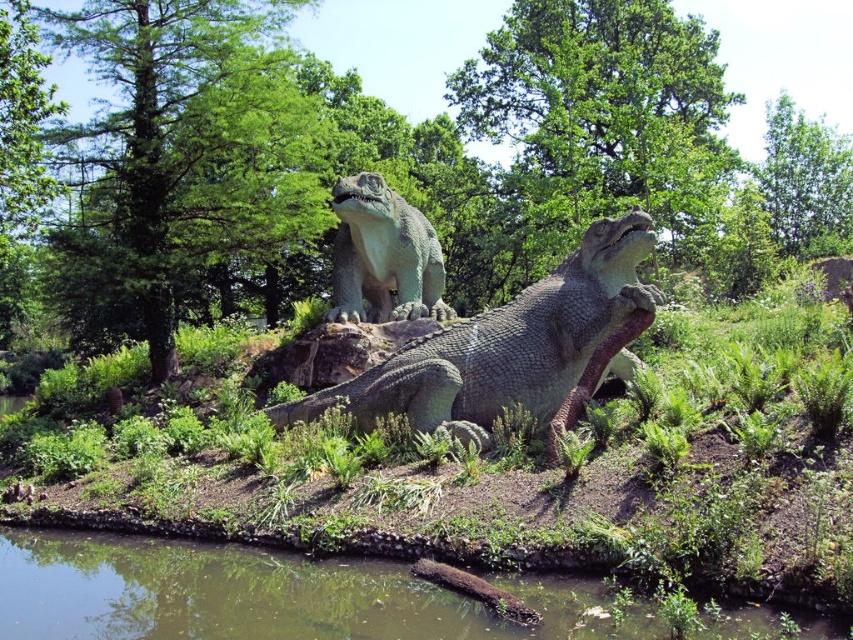
Is point (374, 570) closer to viewer compared to point (363, 317)?

That is True.

Which is behind, point (20, 584) or point (370, 198)?

Point (370, 198)

Identify the location of greenish water at lower center. Image resolution: width=853 pixels, height=640 pixels. (268, 595).

Who is more forward, (410, 424) or (399, 205)?

Positioned in front is point (410, 424).

The image size is (853, 640). In order to click on smooth gray crocodile at center in this screenshot , I will do `click(512, 348)`.

The height and width of the screenshot is (640, 853). What are the coordinates of `smooth gray crocodile at center` in the screenshot? It's located at (512, 348).

Is greenish water at lower center thinner than smooth gray crocodile at center?

Correct, greenish water at lower center's width is less than smooth gray crocodile at center's.

Looking at this image, who is higher up, greenish water at lower center or smooth gray crocodile at center?

smooth gray crocodile at center

Identify the location of greenish water at lower center. (268, 595).

I want to click on greenish water at lower center, so click(x=268, y=595).